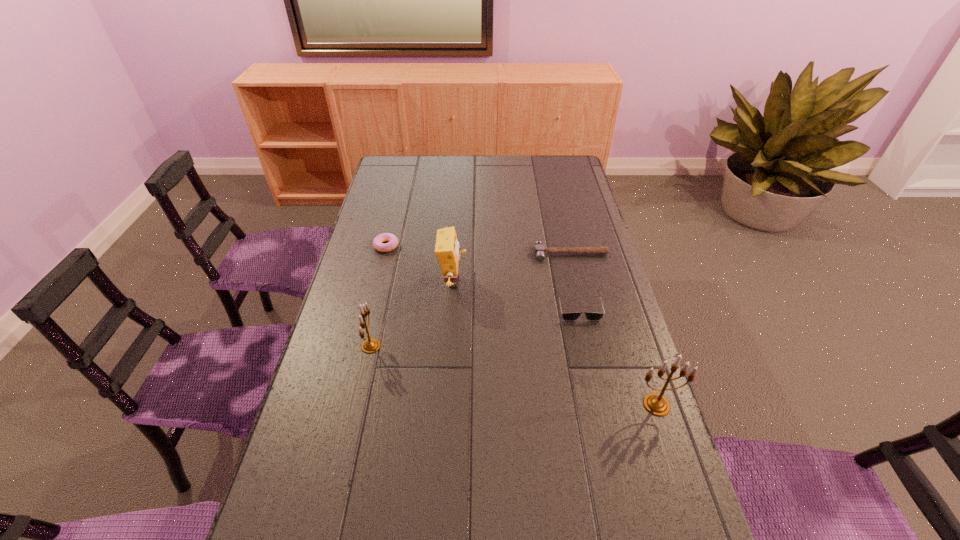
Find the location of a particular element. Image resolution: width=960 pixels, height=540 pixels. blank space located on the face of the third object from left to right is located at coordinates (482, 282).

Locate an element on the screen. The width and height of the screenshot is (960, 540). vacant space positioned on the front-facing side of the sunglasses is located at coordinates (594, 376).

Identify the location of vacant space positioned 0.300m on the striking face of the hammer. (588, 328).

At what (x,y) coordinates should I click in order to perform the action: click on free point located on the back of the doughnut. Please return your answer as a coordinate pair (x, y). This screenshot has height=540, width=960. Looking at the image, I should click on (396, 202).

The height and width of the screenshot is (540, 960). I want to click on candelabrum positioned at the left edge, so click(x=370, y=345).

Where is `doughnut located in the left edge section of the desktop`? This screenshot has height=540, width=960. doughnut located in the left edge section of the desktop is located at coordinates (392, 240).

Where is `candelabrum at the right edge`? The width and height of the screenshot is (960, 540). candelabrum at the right edge is located at coordinates pyautogui.click(x=655, y=403).

The image size is (960, 540). Identify the location of sunglasses that is at the right edge. (590, 316).

Where is `hammer at the right edge`? The height and width of the screenshot is (540, 960). hammer at the right edge is located at coordinates [539, 250].

Image resolution: width=960 pixels, height=540 pixels. I want to click on free point at the far edge, so click(476, 179).